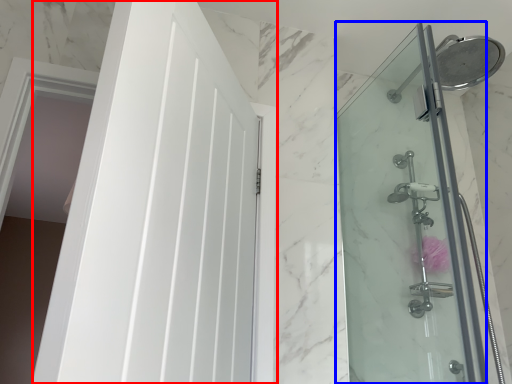
Question: Which object appears farthest to the camera in this image, door (highlighted by a red box) or screen door (highlighted by a blue box)?

Choices:
 (A) door
 (B) screen door

Answer: (B)